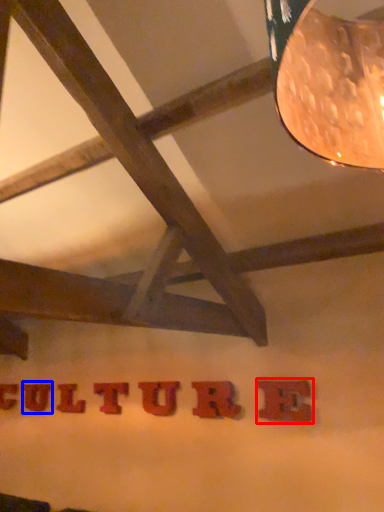
Question: Which object is further to the camera taking this photo, letter (highlighted by a red box) or letter (highlighted by a blue box)?

Choices:
 (A) letter
 (B) letter

Answer: (B)